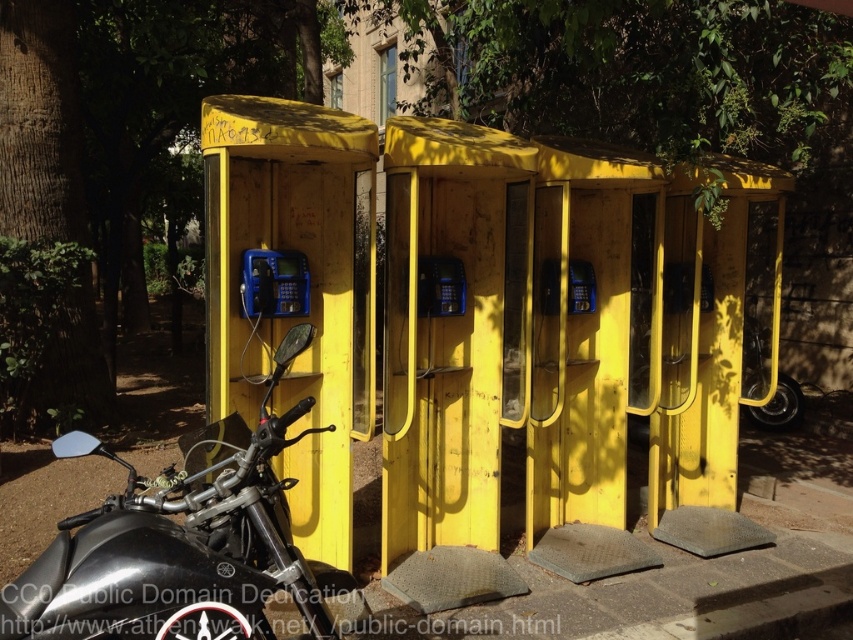
Who is lower down, black metallic motorcycle at left or blue plastic payphone at center?

black metallic motorcycle at left is below.

Can you confirm if black metallic motorcycle at left is bigger than blue plastic payphone at center?

Correct, black metallic motorcycle at left is larger in size than blue plastic payphone at center.

At what (x,y) coordinates should I click in order to perform the action: click on black metallic motorcycle at left. Please return your answer as a coordinate pair (x, y). This screenshot has height=640, width=853. Looking at the image, I should click on (178, 545).

I want to click on black metallic motorcycle at left, so (178, 545).